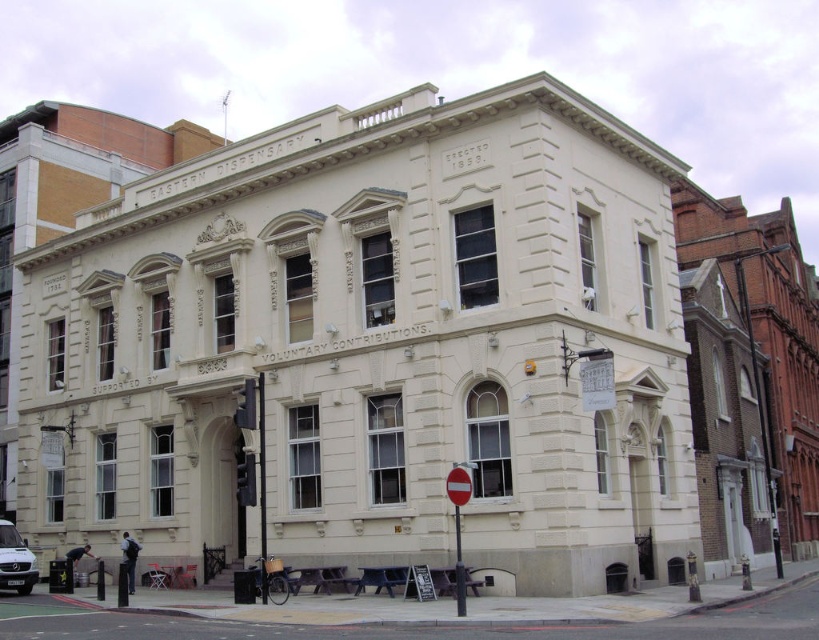
Is silver metallic van at lower left positioned behind red plastic sign at center?

That is True.

This screenshot has height=640, width=819. Find the location of `silver metallic van at lower left`. silver metallic van at lower left is located at coordinates (16, 561).

Locate an element on the screen. silver metallic van at lower left is located at coordinates (16, 561).